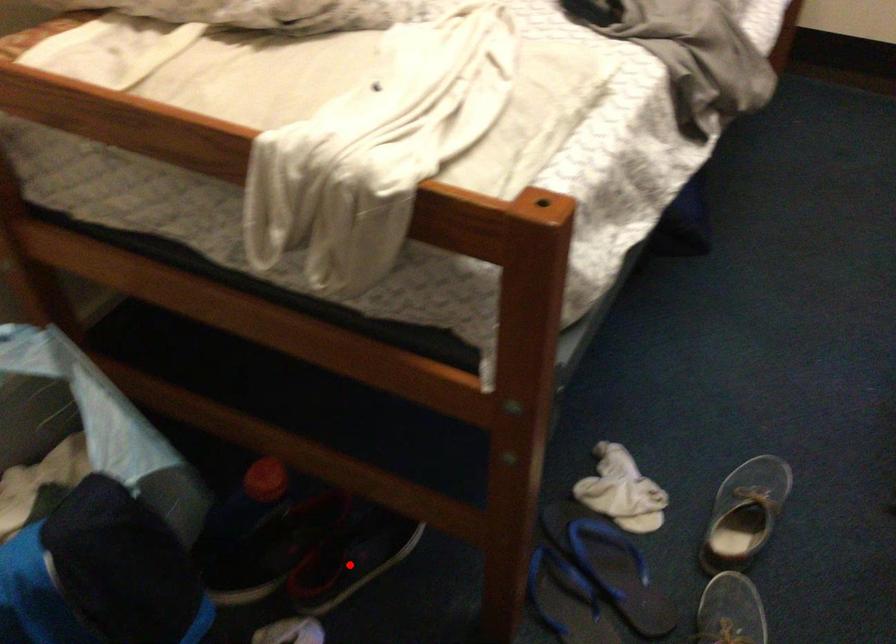
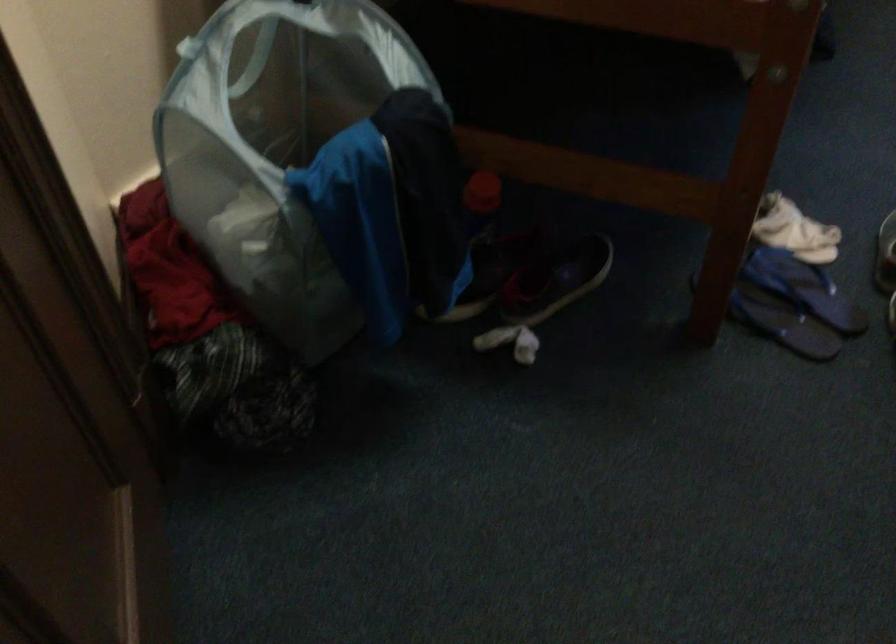
Locate, in the second image, the point that corresponds to the highlighted location in the first image.

(556, 279)